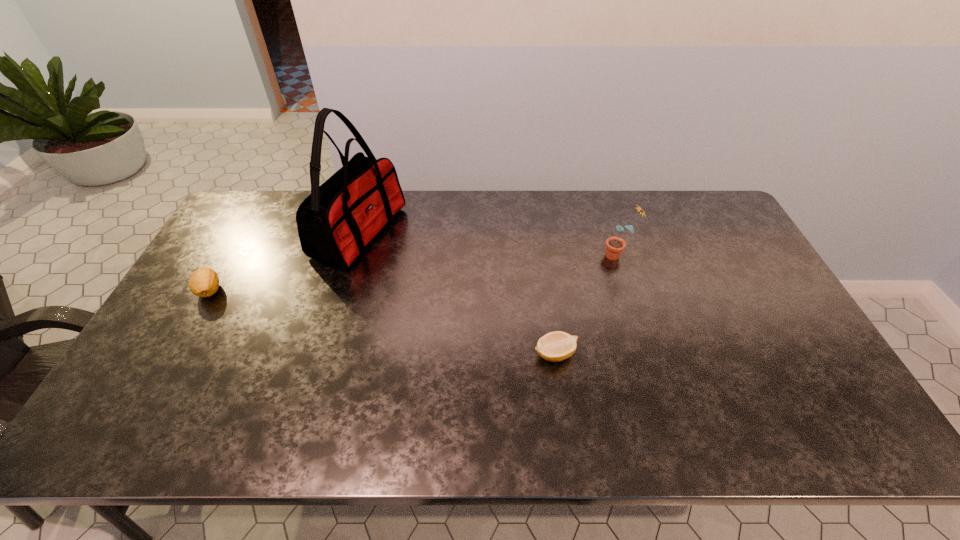
You are a GUI agent. You are given a task and a screenshot of the screen. Output one action in this format:
    pyautogui.click(x=<x>, y=<y>)
    Task: Click on the free region at the far left corner
    This screenshot has height=540, width=960.
    Given the screenshot: What is the action you would take?
    coord(266,191)

This screenshot has height=540, width=960. Identify the location of vacant area between the sunflower and the nearer lemon. (587, 305).

You are a GUI agent. You are given a task and a screenshot of the screen. Output one action in this format:
    pyautogui.click(x=<x>, y=<y>)
    Task: Click on the vacant space that's between the rightmost object and the third farthest object
    
    Given the screenshot: What is the action you would take?
    pyautogui.click(x=414, y=273)

Where is `unoccupied position between the duffel bag and the left lemon`? This screenshot has width=960, height=540. unoccupied position between the duffel bag and the left lemon is located at coordinates (284, 261).

This screenshot has width=960, height=540. What are the coordinates of `free space between the sunflower and the duffel bag` in the screenshot? It's located at (489, 244).

Identify the location of free area in between the sunflower and the right lemon. (587, 305).

Where is `vacant area between the right lemon and the tallest object`? This screenshot has width=960, height=540. vacant area between the right lemon and the tallest object is located at coordinates (457, 293).

The width and height of the screenshot is (960, 540). Identify the location of vacant space that's between the second nearest object and the third shortest object. (414, 273).

Where is `free area in between the duffel bag and the right lemon`? This screenshot has width=960, height=540. free area in between the duffel bag and the right lemon is located at coordinates (457, 293).

The height and width of the screenshot is (540, 960). What are the coordinates of `free space between the rightmost object and the second object from left to right` in the screenshot? It's located at (489, 244).